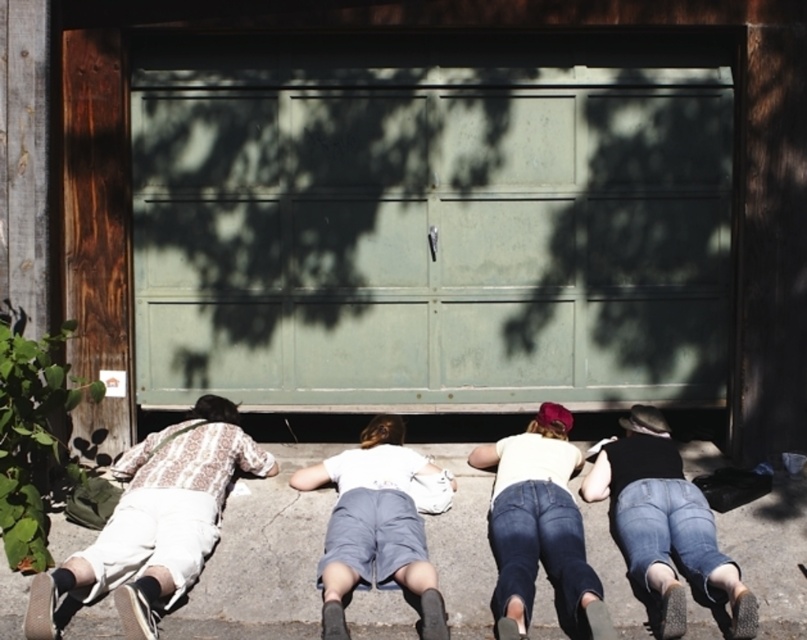
Does gray concrete pavement at center appear on the left side of white cotton shirt at left?

No, gray concrete pavement at center is not to the left of white cotton shirt at left.

Can you confirm if gray concrete pavement at center is positioned above white cotton shirt at left?

No.

Does point (278, 612) come in front of point (199, 397)?

Yes, it is.

Identify the location of gray concrete pavement at center. This screenshot has height=640, width=807. (262, 560).

Does gray concrete pavement at center have a greater height compared to white cotton shirt at center?

Incorrect, gray concrete pavement at center's height is not larger of white cotton shirt at center's.

Can you confirm if gray concrete pavement at center is positioned above white cotton shirt at center?

No, gray concrete pavement at center is not above white cotton shirt at center.

What do you see at coordinates (262, 560) in the screenshot? The image size is (807, 640). I see `gray concrete pavement at center` at bounding box center [262, 560].

You are a GUI agent. You are given a task and a screenshot of the screen. Output one action in this format:
    pyautogui.click(x=<x>, y=<y>)
    Task: Click on the gray concrete pavement at center
    This screenshot has width=807, height=640.
    Given the screenshot: What is the action you would take?
    pyautogui.click(x=262, y=560)

Is green painted metal at center to the right of white cotton shirt at left from the viewer's perspective?

Yes, green painted metal at center is to the right of white cotton shirt at left.

Does green painted metal at center have a lesser height compared to white cotton shirt at left?

No, green painted metal at center is not shorter than white cotton shirt at left.

What do you see at coordinates (429, 230) in the screenshot? I see `green painted metal at center` at bounding box center [429, 230].

Where is `green painted metal at center`? The width and height of the screenshot is (807, 640). green painted metal at center is located at coordinates (429, 230).